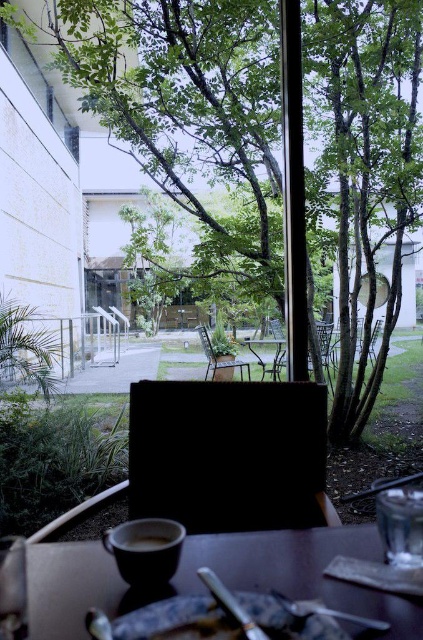
You are a barista carrying a tray of dishes and need to place the matte ceramic plate at lower center on a shelf that is 60 centimeters away from you. Can you safely place it without overreaching?

The matte ceramic plate at lower center is 71.96 centimeters away from the viewer, which is farther than the 60 centimeter shelf distance. Therefore, you cannot safely place it without overreaching.

You are standing at the point labeled point at (414, 227). You want to walk to the nearest tree in the courtyard. How far will you have to walk?

The distance between you and the nearest tree is 15.97 feet, so you will have to walk 15.97 feet to reach it.

You are a window cleaner standing at the edge of the courtyard. You need to clean the window that shows the green leafy tree at center and the matte ceramic cup at lower center. Which object will require you to climb higher to clean its reflection on the window?

The green leafy tree at center is much taller than the matte ceramic cup at lower center, so you will need to climb higher to clean the reflection of the green leafy tree at center on the window.